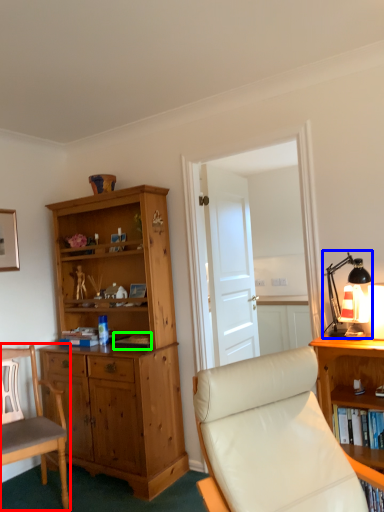
Question: Considering the real-world distances, which object is closest to chair (highlighted by a red box)? table lamp (highlighted by a blue box) or book (highlighted by a green box).

Choices:
 (A) table lamp
 (B) book

Answer: (B)